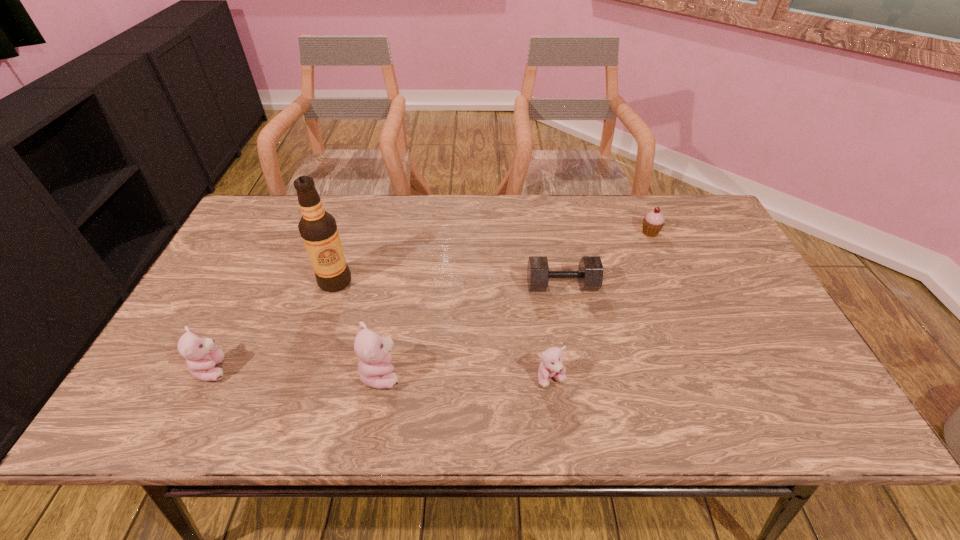
The teddy bears are evenly distributed in the image. To maintain this, where would you place another teddy bear on the right? Please point to a free space. Please provide its 2D coordinates. Your answer should be formatted as a tuple, i.e. [(x, y)], where the tuple contains the x and y coordinates of a point satisfying the conditions above.

[(725, 383)]